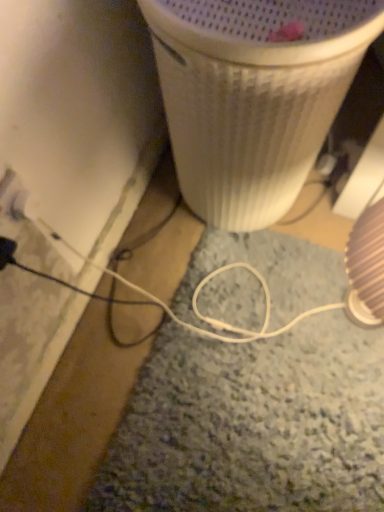
Describe the element at coordinates (253, 96) in the screenshot. The width and height of the screenshot is (384, 512). I see `white ribbed plastic at center` at that location.

Where is `white ribbed plastic at center`? white ribbed plastic at center is located at coordinates (253, 96).

At what (x,y) coordinates should I click in order to perform the action: click on white ribbed plastic at center. Please return your answer as a coordinate pair (x, y). Looking at the image, I should click on (253, 96).